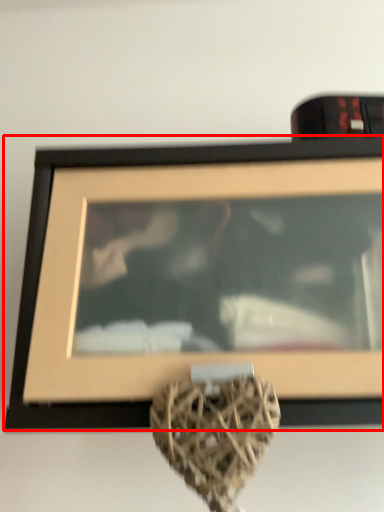
Question: From the image's perspective, where is picture frame (annotated by the red box) located relative to vase?

Choices:
 (A) below
 (B) above

Answer: (B)